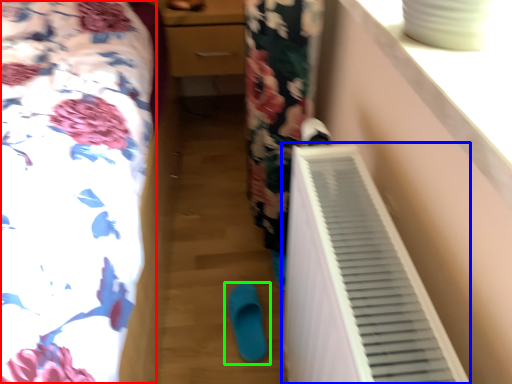
Question: Which object is the farthest from furniture (highlighted by a red box)? Choose among these: air conditioning (highlighted by a blue box) or footwear (highlighted by a green box).

Choices:
 (A) air conditioning
 (B) footwear

Answer: (B)